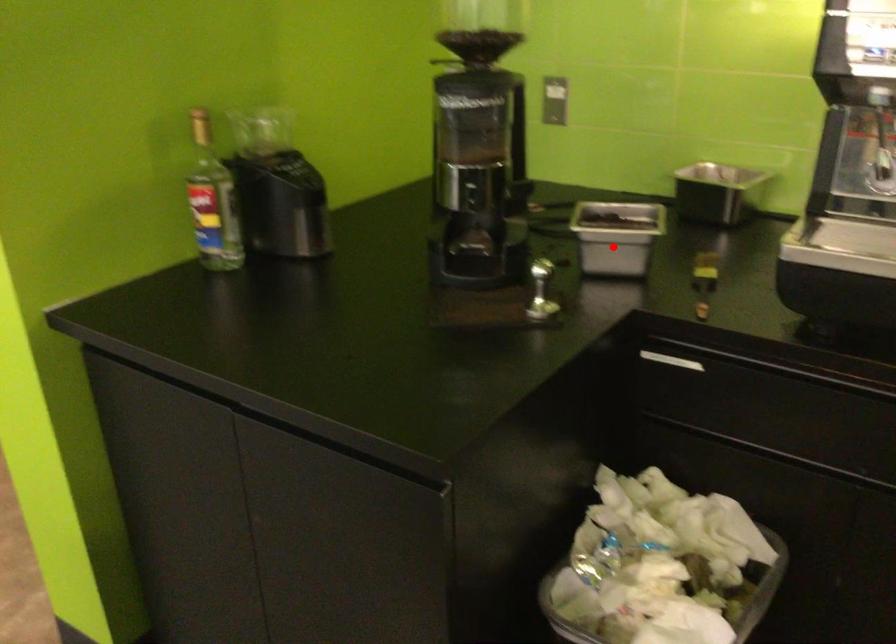
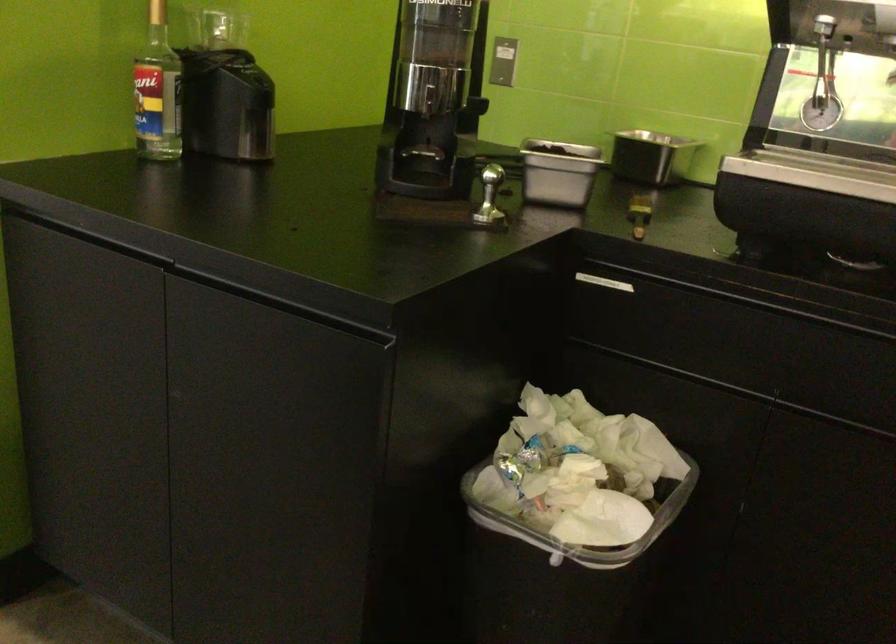
Locate, in the second image, the point that corresponds to the highlighted location in the first image.

(558, 172)